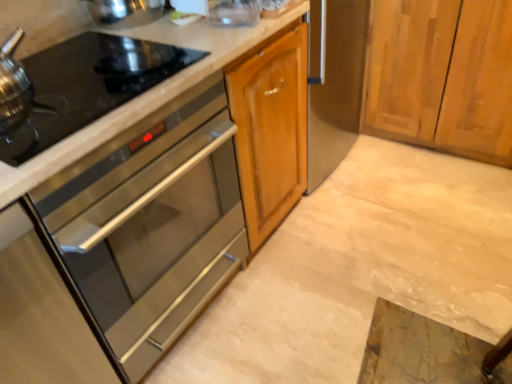
Question: Is black glass gas stove at left looking in the opposite direction of stainless steel oven at left?

Choices:
 (A) yes
 (B) no

Answer: (B)

Question: Is the depth of black glass gas stove at left greater than that of stainless steel oven at left?

Choices:
 (A) yes
 (B) no

Answer: (A)

Question: Is black glass gas stove at left in front of stainless steel oven at left?

Choices:
 (A) no
 (B) yes

Answer: (A)

Question: Considering the relative positions of black glass gas stove at left and stainless steel oven at left in the image provided, is black glass gas stove at left to the left of stainless steel oven at left from the viewer's perspective?

Choices:
 (A) yes
 (B) no

Answer: (A)

Question: Can you confirm if black glass gas stove at left is wider than stainless steel oven at left?

Choices:
 (A) yes
 (B) no

Answer: (B)

Question: Is black glass gas stove at left facing towards stainless steel oven at left?

Choices:
 (A) yes
 (B) no

Answer: (B)

Question: Considering the relative sizes of stainless steel oven at left and marble countertop at center in the image provided, is stainless steel oven at left shorter than marble countertop at center?

Choices:
 (A) yes
 (B) no

Answer: (B)

Question: Considering the relative sizes of stainless steel oven at left and marble countertop at center in the image provided, is stainless steel oven at left taller than marble countertop at center?

Choices:
 (A) yes
 (B) no

Answer: (A)

Question: Is stainless steel oven at left aimed at marble countertop at center?

Choices:
 (A) yes
 (B) no

Answer: (B)

Question: From the image's perspective, would you say stainless steel oven at left is positioned over marble countertop at center?

Choices:
 (A) no
 (B) yes

Answer: (B)

Question: Is stainless steel oven at left smaller than marble countertop at center?

Choices:
 (A) yes
 (B) no

Answer: (B)

Question: Can you confirm if stainless steel oven at left is positioned to the left of marble countertop at center?

Choices:
 (A) yes
 (B) no

Answer: (A)

Question: Considering the relative sizes of black glass gas stove at left and marble countertop at center in the image provided, is black glass gas stove at left wider than marble countertop at center?

Choices:
 (A) no
 (B) yes

Answer: (A)